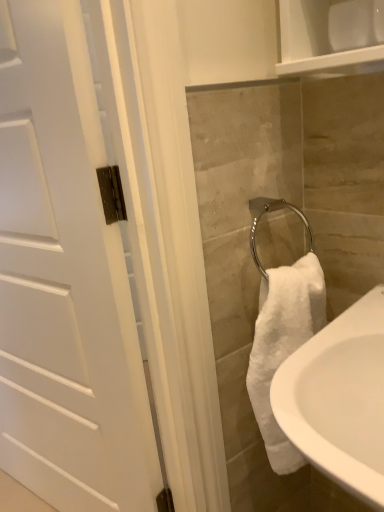
Where is `white matte door at left`? This screenshot has width=384, height=512. white matte door at left is located at coordinates (64, 281).

What is the approximate height of white matte door at left?

The height of white matte door at left is 4.66 feet.

Image resolution: width=384 pixels, height=512 pixels. What do you see at coordinates (64, 281) in the screenshot?
I see `white matte door at left` at bounding box center [64, 281].

This screenshot has height=512, width=384. What do you see at coordinates (339, 399) in the screenshot? I see `white ceramic sink at lower right` at bounding box center [339, 399].

The image size is (384, 512). In order to click on white ceramic sink at lower right in this screenshot , I will do `click(339, 399)`.

The image size is (384, 512). I want to click on white matte door at left, so 64,281.

Which is more to the right, white ceramic sink at lower right or white matte door at left?

Positioned to the right is white ceramic sink at lower right.

Which object is closer to the camera taking this photo, white ceramic sink at lower right or white matte door at left?

Positioned in front is white ceramic sink at lower right.

Does point (373, 376) come farther from viewer compared to point (36, 455)?

No, (373, 376) is in front of (36, 455).

From the image's perspective, is white ceramic sink at lower right beneath white matte door at left?

Indeed, from the image's perspective, white ceramic sink at lower right is shown beneath white matte door at left.

From a real-world perspective, is white ceramic sink at lower right positioned above or below white matte door at left?

white ceramic sink at lower right is situated lower than white matte door at left in the real world.

Considering the relative sizes of white ceramic sink at lower right and white matte door at left in the image provided, is white ceramic sink at lower right wider than white matte door at left?

Yes, white ceramic sink at lower right is wider than white matte door at left.

Who is shorter, white ceramic sink at lower right or white matte door at left?

With less height is white ceramic sink at lower right.

Is white ceramic sink at lower right smaller than white matte door at left?

Correct, white ceramic sink at lower right occupies less space than white matte door at left.

Is white ceramic sink at lower right spatially inside white matte door at left, or outside of it?

white ceramic sink at lower right is not inside white matte door at left, it's outside.

Would you say white ceramic sink at lower right is a long distance from white matte door at left?

No, white ceramic sink at lower right is not far from white matte door at left.

Is white ceramic sink at lower right facing towards white matte door at left?

No, white ceramic sink at lower right is not turned towards white matte door at left.

How many degrees apart are the facing directions of white ceramic sink at lower right and white matte door at left?

The angle between the facing direction of white ceramic sink at lower right and the facing direction of white matte door at left is 11.3 degrees.

The image size is (384, 512). In order to click on door that is on the left side of white ceramic sink at lower right in this screenshot , I will do `click(64, 281)`.

In the scene shown: Is white matte door at left to the left or to the right of white ceramic sink at lower right in the image?

In the image, white matte door at left appears on the left side of white ceramic sink at lower right.

Does white matte door at left lie in front of white ceramic sink at lower right?

No, white matte door at left is further to the viewer.

Which is in front, point (84, 502) or point (339, 448)?

The point (339, 448) is in front.

From the image's perspective, who appears lower, white matte door at left or white ceramic sink at lower right?

white ceramic sink at lower right is shown below in the image.

From a real-world perspective, between white matte door at left and white ceramic sink at lower right, who is vertically lower?

From a 3D spatial view, white ceramic sink at lower right is below.

Considering the relative sizes of white matte door at left and white ceramic sink at lower right in the image provided, is white matte door at left thinner than white ceramic sink at lower right?

Yes, white matte door at left is thinner than white ceramic sink at lower right.

Considering the relative sizes of white matte door at left and white ceramic sink at lower right in the image provided, is white matte door at left shorter than white ceramic sink at lower right?

Incorrect, the height of white matte door at left does not fall short of that of white ceramic sink at lower right.

Which of these two, white matte door at left or white ceramic sink at lower right, is smaller?

white ceramic sink at lower right is smaller.

Would you say white matte door at left contains white ceramic sink at lower right?

No, white ceramic sink at lower right is not inside white matte door at left.

Is white matte door at left far from white ceramic sink at lower right?

No.

Is white matte door at left oriented away from white ceramic sink at lower right?

white matte door at left does not have its back to white ceramic sink at lower right.

How different are the orientations of white matte door at left and white ceramic sink at lower right in degrees?

The angular difference between white matte door at left and white ceramic sink at lower right is 11.3 degrees.

Where is `door on the left of white ceramic sink at lower right`? door on the left of white ceramic sink at lower right is located at coordinates (64, 281).

Where is `door to the left of white ceramic sink at lower right`? door to the left of white ceramic sink at lower right is located at coordinates (64, 281).

This screenshot has height=512, width=384. I want to click on sink below the white matte door at left (from the image's perspective), so click(x=339, y=399).